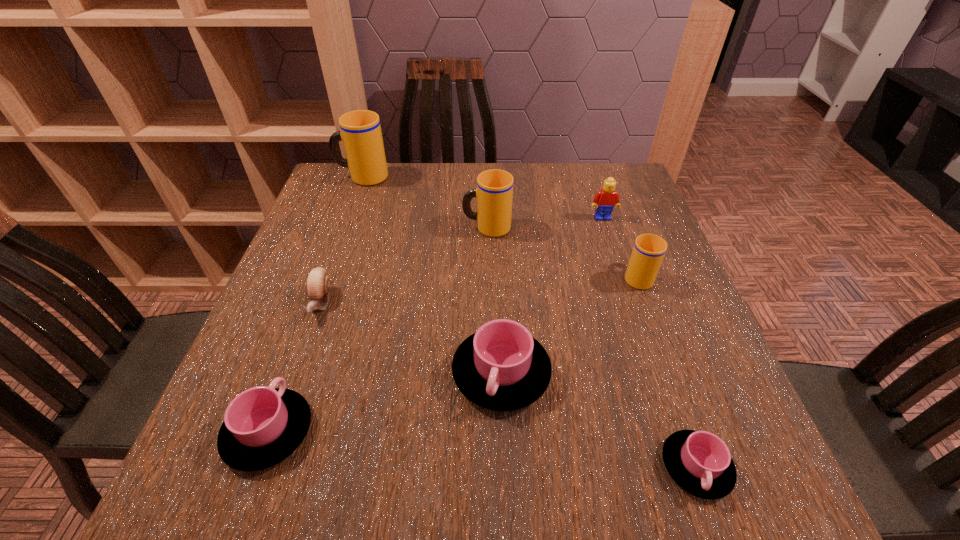
You are a GUI agent. You are given a task and a screenshot of the screen. Output one action in this format:
    pyautogui.click(x=<x>, y=<y>)
    Task: Click on the vacant position located 0.280m on the side of the third tallest cup with the handle
    The height and width of the screenshot is (540, 960).
    Given the screenshot: What is the action you would take?
    pyautogui.click(x=608, y=195)

Locate an element on the screen. The width and height of the screenshot is (960, 540). vacant space located on the side with the handle of the fifth tallest object is located at coordinates tap(504, 446).

Where is `vacant space located 0.190m on the side with the handle of the second smallest pink cup`? Image resolution: width=960 pixels, height=540 pixels. vacant space located 0.190m on the side with the handle of the second smallest pink cup is located at coordinates (312, 313).

Locate an element on the screen. free space located 0.210m on the side with the handle of the second smallest pink cup is located at coordinates (315, 306).

The image size is (960, 540). What are the coordinates of `vacant space located on the side with the handle of the second smallest pink cup` in the screenshot? It's located at (329, 264).

The height and width of the screenshot is (540, 960). I want to click on vacant space located on the front-facing side of the escargot, so click(x=285, y=403).

The height and width of the screenshot is (540, 960). Find the location of `object at the far edge`. object at the far edge is located at coordinates (361, 134).

I want to click on escargot that is at the left edge, so click(x=318, y=282).

I want to click on Lego present at the right edge, so coord(606,199).

Where is `object positioned at the far left corner`? object positioned at the far left corner is located at coordinates (361, 134).